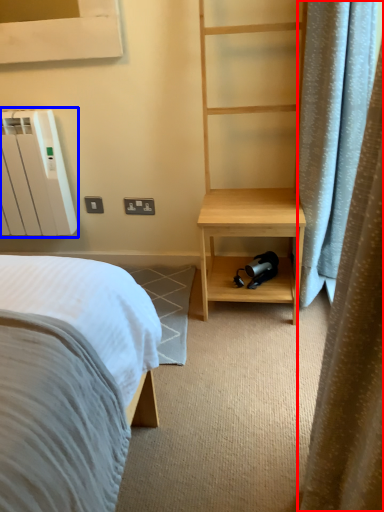
Question: Among these objects, which one is nearest to the camera, curtain (highlighted by a red box) or radiator (highlighted by a blue box)?

Choices:
 (A) curtain
 (B) radiator

Answer: (A)